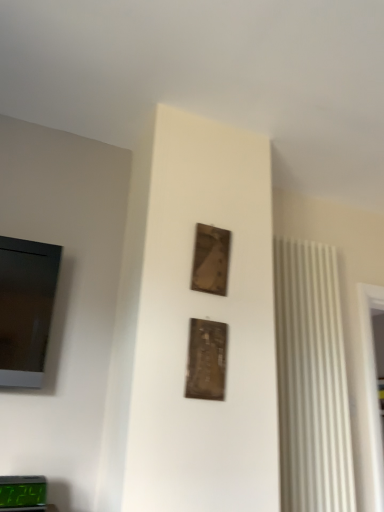
What is the approximate width of green digital display at lower left?

green digital display at lower left is 3.30 inches in width.

The height and width of the screenshot is (512, 384). Describe the element at coordinates (22, 492) in the screenshot. I see `green digital display at lower left` at that location.

At what (x,y) coordinates should I click in order to perform the action: click on metallic gold picture frame at center, the 1th picture frame positioned from the front. Please return your answer as a coordinate pair (x, y). Looking at the image, I should click on (206, 360).

Measure the distance between green digital display at lower left and wooden frame at upper center, the 2th picture frame positioned from the front.

32.98 inches.

From the image's perspective, does green digital display at lower left appear higher than wooden frame at upper center, the 2th picture frame positioned from the front?

Incorrect, from the image's perspective, green digital display at lower left is lower than wooden frame at upper center, the 2th picture frame positioned from the front.

Is green digital display at lower left in front of or behind wooden frame at upper center, the 1th picture frame positioned from the back, in the image?

Visually, green digital display at lower left is located in front of wooden frame at upper center, the 1th picture frame positioned from the back.

Does green digital display at lower left touch wooden frame at upper center, which is the 1th picture frame in top-to-bottom order?

No, green digital display at lower left is not with wooden frame at upper center, which is the 1th picture frame in top-to-bottom order.

From a real-world perspective, which is physically above, metallic gold picture frame at center, placed as the second picture frame when sorted from top to bottom, or green digital display at lower left?

From a 3D spatial view, metallic gold picture frame at center, placed as the second picture frame when sorted from top to bottom, is above.

Considering the relative sizes of metallic gold picture frame at center, the 1th picture frame positioned from the front, and green digital display at lower left in the image provided, is metallic gold picture frame at center, the 1th picture frame positioned from the front, wider than green digital display at lower left?

No.

Is point (191, 321) in front of point (30, 490)?

No, (191, 321) is further to viewer.

Identify the location of alarm clock below the metallic gold picture frame at center, acting as the first picture frame starting from the bottom (from a real-world perspective). The height and width of the screenshot is (512, 384). (22, 492).

Is green digital display at lower left positioned behind metallic gold picture frame at center, arranged as the second picture frame when viewed from the back?

No, green digital display at lower left is closer to the camera.

Looking at this image, is green digital display at lower left taller than metallic gold picture frame at center, placed as the second picture frame when sorted from top to bottom?

Incorrect, the height of green digital display at lower left is not larger of that of metallic gold picture frame at center, placed as the second picture frame when sorted from top to bottom.

Is green digital display at lower left located within wooden frame at upper center, the second picture frame in the bottom-to-top sequence?

Actually, green digital display at lower left is outside wooden frame at upper center, the second picture frame in the bottom-to-top sequence.

This screenshot has height=512, width=384. I want to click on the 2nd picture frame directly above the green digital display at lower left (from a real-world perspective), so click(x=211, y=260).

Is the depth of wooden frame at upper center, which is the 1th picture frame in top-to-bottom order, greater than that of green digital display at lower left?

Yes, wooden frame at upper center, which is the 1th picture frame in top-to-bottom order, is further from the camera.

What's the angular difference between wooden frame at upper center, which is the 1th picture frame in top-to-bottom order, and green digital display at lower left's facing directions?

The angular difference between wooden frame at upper center, which is the 1th picture frame in top-to-bottom order, and green digital display at lower left is 5.57 degrees.

From a real-world perspective, is metallic gold picture frame at center, acting as the first picture frame starting from the bottom, above or below wooden frame at upper center, the 2th picture frame positioned from the front?

metallic gold picture frame at center, acting as the first picture frame starting from the bottom, is below wooden frame at upper center, the 2th picture frame positioned from the front.

Would you say metallic gold picture frame at center, arranged as the second picture frame when viewed from the back, is to the left or to the right of wooden frame at upper center, the 2th picture frame positioned from the front, in the picture?

From the image, it's evident that metallic gold picture frame at center, arranged as the second picture frame when viewed from the back, is to the left of wooden frame at upper center, the 2th picture frame positioned from the front.

From their relative heights in the image, would you say metallic gold picture frame at center, arranged as the second picture frame when viewed from the back, is taller or shorter than wooden frame at upper center, which is the 1th picture frame in top-to-bottom order?

In the image, metallic gold picture frame at center, arranged as the second picture frame when viewed from the back, appears to be taller than wooden frame at upper center, which is the 1th picture frame in top-to-bottom order.

Is metallic gold picture frame at center, the 1th picture frame positioned from the front, oriented away from wooden frame at upper center, which is the 1th picture frame in top-to-bottom order?

No, wooden frame at upper center, which is the 1th picture frame in top-to-bottom order, is not at the back of metallic gold picture frame at center, the 1th picture frame positioned from the front.

Can you confirm if wooden frame at upper center, which is the 1th picture frame in top-to-bottom order, is bigger than metallic gold picture frame at center, placed as the second picture frame when sorted from top to bottom?

No, wooden frame at upper center, which is the 1th picture frame in top-to-bottom order, is not bigger than metallic gold picture frame at center, placed as the second picture frame when sorted from top to bottom.

From the image's perspective, which is above, wooden frame at upper center, the second picture frame in the bottom-to-top sequence, or metallic gold picture frame at center, arranged as the second picture frame when viewed from the back?

From the image's view, wooden frame at upper center, the second picture frame in the bottom-to-top sequence, is above.

Which point is more distant from viewer, [224,257] or [203,325]?

The point [224,257] is more distant.

Is wooden frame at upper center, the 1th picture frame positioned from the back, at the right side of metallic gold picture frame at center, arranged as the second picture frame when viewed from the back?

Indeed, wooden frame at upper center, the 1th picture frame positioned from the back, is positioned on the right side of metallic gold picture frame at center, arranged as the second picture frame when viewed from the back.

Identify the location of alarm clock that is in front of the wooden frame at upper center, the second picture frame in the bottom-to-top sequence. (22, 492).

Find the location of a particular element. alarm clock on the left of metallic gold picture frame at center, acting as the first picture frame starting from the bottom is located at coordinates 22,492.

Looking at the image, which one is located closer to wooden frame at upper center, the second picture frame in the bottom-to-top sequence, metallic gold picture frame at center, the 1th picture frame positioned from the front, or green digital display at lower left?

metallic gold picture frame at center, the 1th picture frame positioned from the front, lies closer to wooden frame at upper center, the second picture frame in the bottom-to-top sequence, than the other object.

Estimate the real-world distances between objects in this image. Which object is further from green digital display at lower left, wooden frame at upper center, the 2th picture frame positioned from the front, or metallic gold picture frame at center, the 1th picture frame positioned from the front?

Among the two, wooden frame at upper center, the 2th picture frame positioned from the front, is located further to green digital display at lower left.

Looking at the image, which one is located further to green digital display at lower left, metallic gold picture frame at center, placed as the second picture frame when sorted from top to bottom, or wooden frame at upper center, which is the 1th picture frame in top-to-bottom order?

wooden frame at upper center, which is the 1th picture frame in top-to-bottom order, is positioned further to the anchor green digital display at lower left.

Which object lies nearer to the anchor point metallic gold picture frame at center, the 1th picture frame positioned from the front, green digital display at lower left or wooden frame at upper center, the second picture frame in the bottom-to-top sequence?

wooden frame at upper center, the second picture frame in the bottom-to-top sequence, is closer to metallic gold picture frame at center, the 1th picture frame positioned from the front.

Based on their spatial positions, is green digital display at lower left or metallic gold picture frame at center, the 1th picture frame positioned from the front, further from wooden frame at upper center, which is the 1th picture frame in top-to-bottom order?

green digital display at lower left.

Looking at the image, which one is located further to metallic gold picture frame at center, placed as the second picture frame when sorted from top to bottom, wooden frame at upper center, which is the 1th picture frame in top-to-bottom order, or green digital display at lower left?

Based on the image, green digital display at lower left appears to be further to metallic gold picture frame at center, placed as the second picture frame when sorted from top to bottom.

Image resolution: width=384 pixels, height=512 pixels. I want to click on picture frame between wooden frame at upper center, which is the 1th picture frame in top-to-bottom order, and green digital display at lower left, in the vertical direction, so click(206, 360).